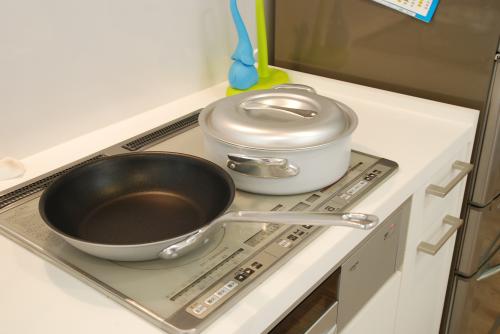
Identify the location of vents on stove top. (34, 186), (145, 138).